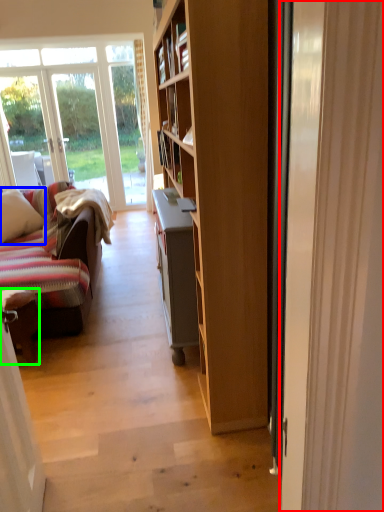
Question: Based on their relative distances, which object is farther from door (highlighted by a red box)? Choose from pillow (highlighted by a blue box) and chair (highlighted by a green box).

Choices:
 (A) pillow
 (B) chair

Answer: (A)